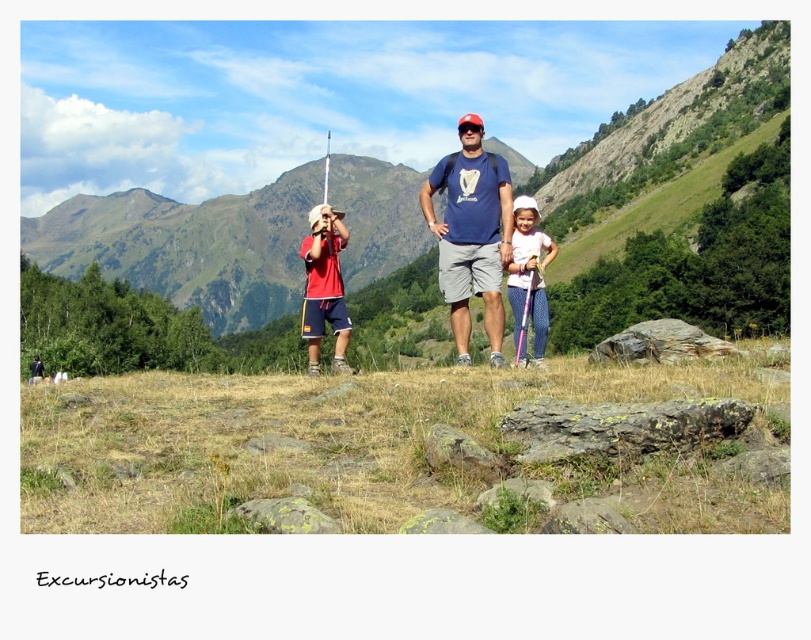
You are standing at the viewpoint and want to reach the point marked as point (483, 252). Is this point within a short walking distance?

The distance between you and point (483, 252) is 138.91 feet, which is approximately 46.3 yards. This distance is considered moderate, so it would require a walk of a few minutes rather than a short stroll.